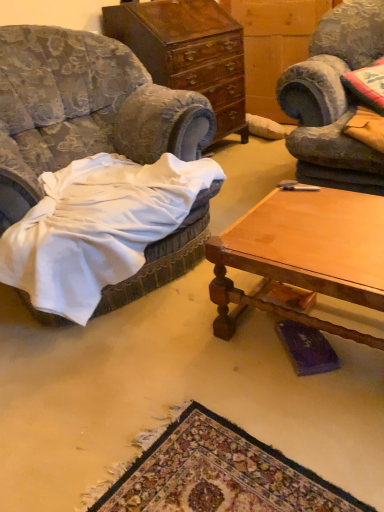
Locate an element on the screen. The width and height of the screenshot is (384, 512). vacant area that is in front of velvet blue armchair at left is located at coordinates (163, 400).